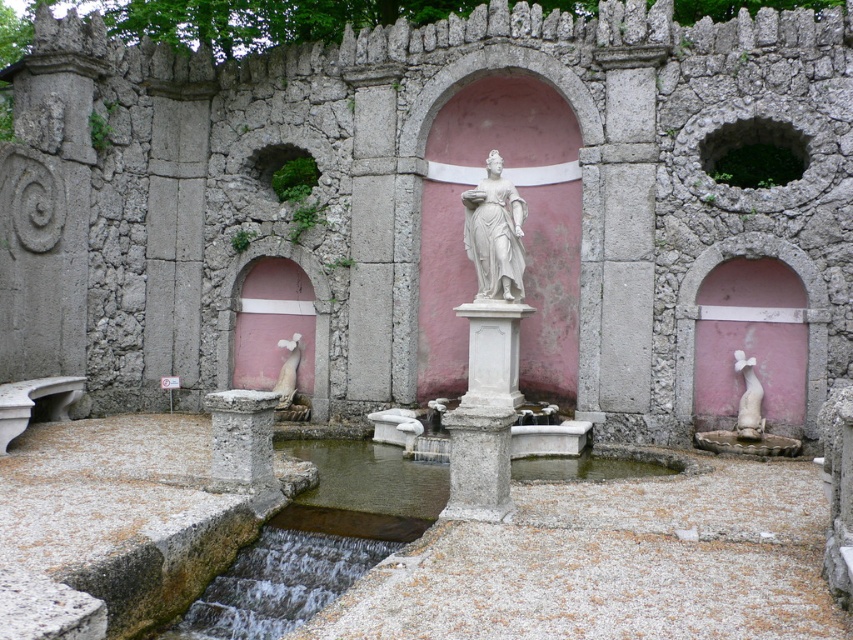
You are an architect designing a new garden layout. You need to place a decorative statue that is 1.2 meters wide between the white stone pillar at center and the white marble fountain at lower right. Based on the scene, will the statue fit between them?

The white stone pillar at center has a lesser width compared to white marble fountain at lower right. Since the statue is 1.2 meters wide, but the exact distance between the two objects isn

You are designing a pathway that needs to pass between the gray stone pillar at center and the white marble fountain at lower right. Based on their widths, can you determine if the path will be narrower on one side of the pillar than the other?

The gray stone pillar at center might be wider than white marble fountain at lower right, so the path on the side of the white marble fountain at lower right would be wider than the path on the side of the gray stone pillar at center.

You are a tour guide leading a group to the gray stone pillar at center. The group is currently standing at the entrance, which is 20 meters away from the pillar. Can you safely lead them to the pillar without exceeding the 20 meter limit?

The distance between the entrance and the gray stone pillar at center is 21.71 meters, which exceeds the 20 meter limit. Therefore, you cannot safely lead them to the pillar without exceeding the limit.